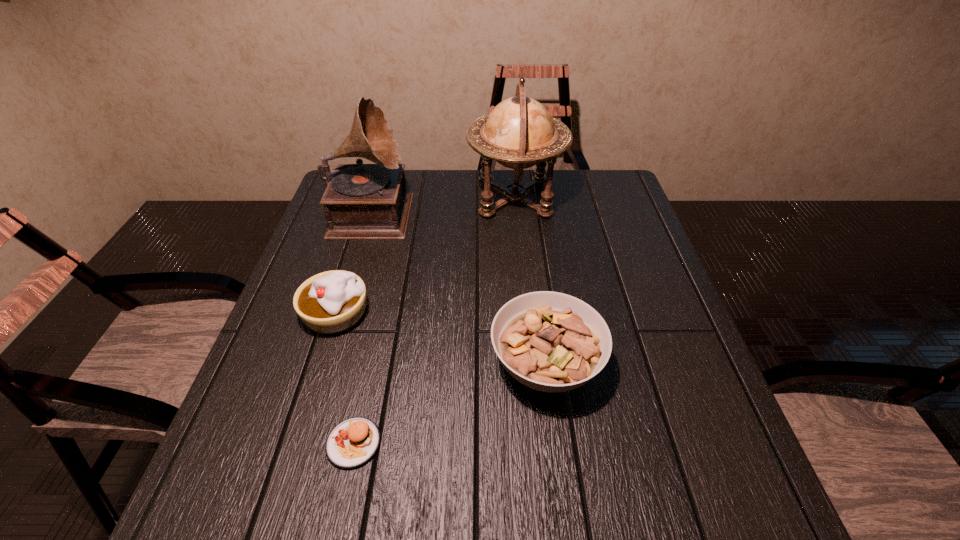
What are the coordinates of `vacant region that satisfies the following two spatial constraints: 1. from the horn of the record player; 2. on the right side of the stew` in the screenshot? It's located at (324, 365).

Where is `free location that satisfies the following two spatial constraints: 1. on the back side of the patty; 2. from the horn of the record player`? The width and height of the screenshot is (960, 540). free location that satisfies the following two spatial constraints: 1. on the back side of the patty; 2. from the horn of the record player is located at coordinates (403, 210).